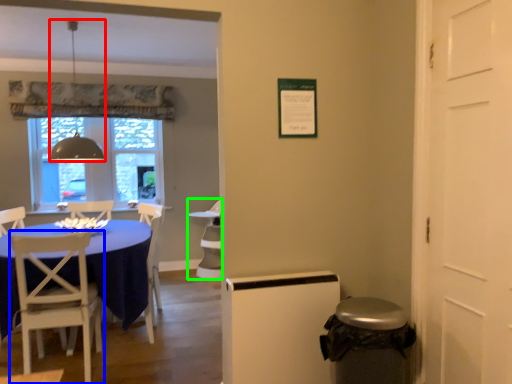
Question: Which object is the closest to the lamp (highlighted by a red box)? Choose among these: chair (highlighted by a blue box) or armchair (highlighted by a green box).

Choices:
 (A) chair
 (B) armchair

Answer: (A)